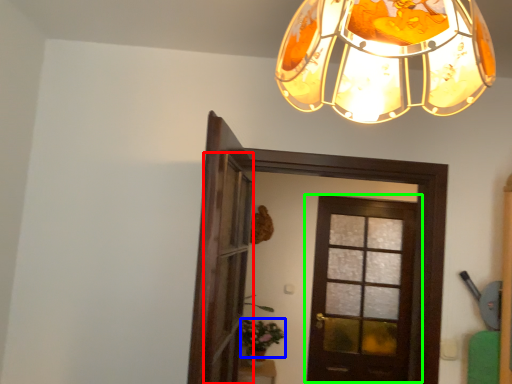
Question: Which is farther away from screen door (highlighted by a red box)? plant (highlighted by a blue box) or door (highlighted by a green box)?

Choices:
 (A) plant
 (B) door

Answer: (B)